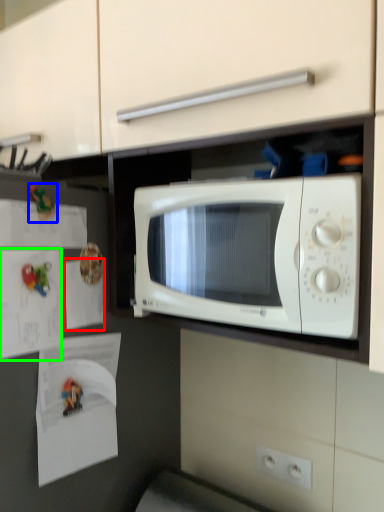
Question: Which is farther away from paper (highlighted by a red box)? toy (highlighted by a blue box) or paper (highlighted by a green box)?

Choices:
 (A) toy
 (B) paper

Answer: (A)